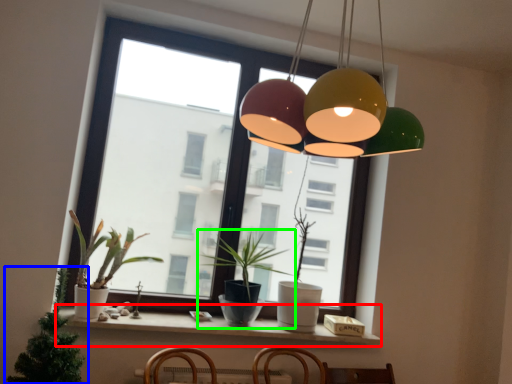
Question: Which object is positioned closest to window sill (highlighted by a red box)? Select from houseplant (highlighted by a blue box) and houseplant (highlighted by a green box).

Choices:
 (A) houseplant
 (B) houseplant

Answer: (B)